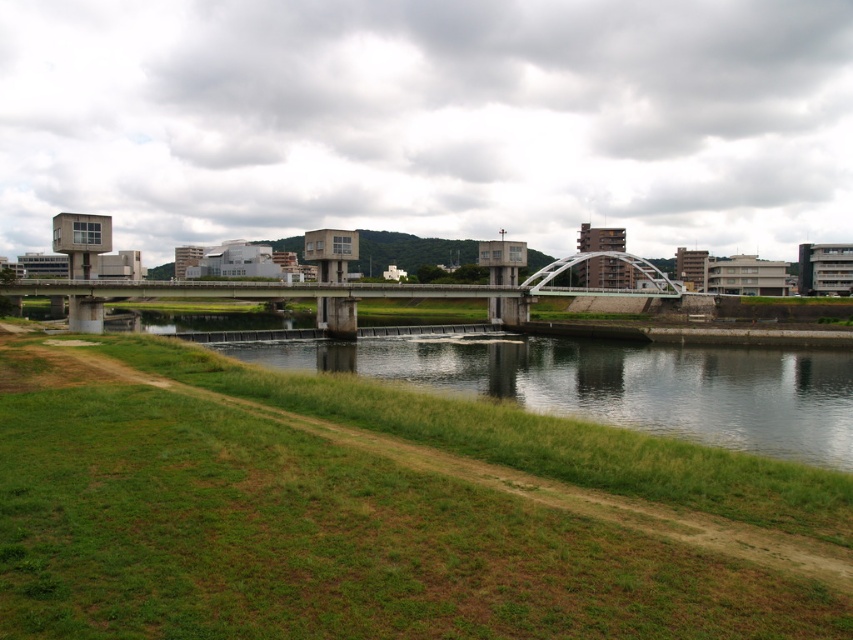
You are standing at the riverside and want to take a photo of both point [338,368] and point [259,292] in the image. Which point should you focus on first to ensure both are in sharp focus?

You should focus on point [338,368] first because it is closer to the camera than point [259,292]. This ensures the closer point is in focus, and the farther point will also be within the depth of field.

You are standing on the green grassy bank at lower left and want to cross to the other side of the river. The concrete bridge at center is your only path. Can you see the bridge from your current position?

Yes, because the green grassy bank at lower left is in front of the concrete bridge at center, so the bridge is directly ahead and visible from your position.

You are a hiker who wants to cross the river using the bridge. From your current position on the green grassy bank at lower left, which direction should you move to reach the concrete bridge at center?

The green grassy bank at lower left is positioned on the right side of the concrete bridge at center. Therefore, you should move to your left to reach the concrete bridge at center from the green grassy bank at lower left.